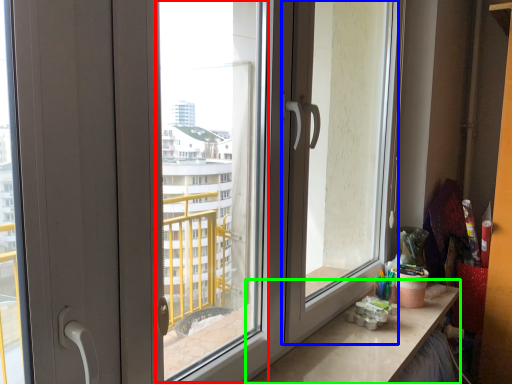
Question: Estimate the real-world distances between objects in this image. Which object is farther from window screen (highlighted by a red box), screen door (highlighted by a blue box) or counter top (highlighted by a green box)?

Choices:
 (A) screen door
 (B) counter top

Answer: (B)